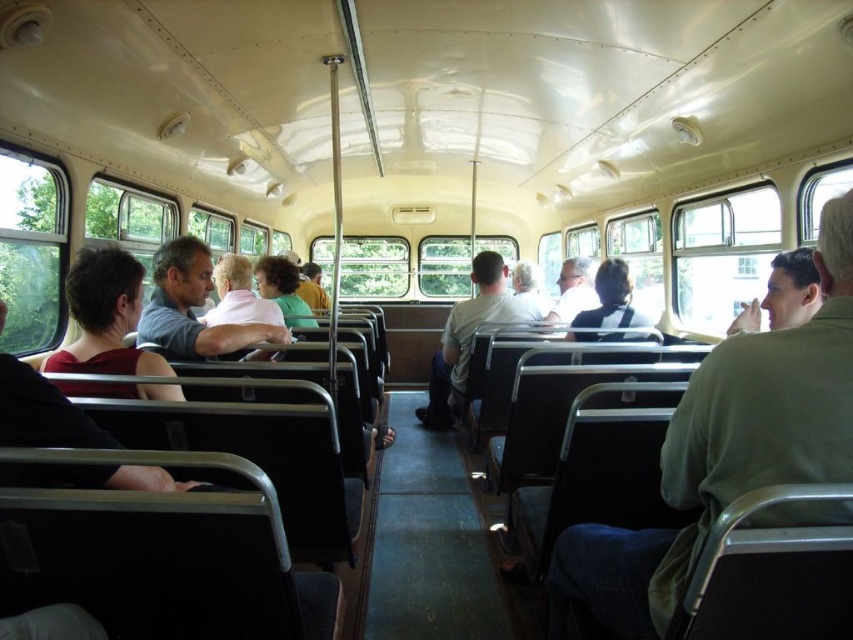
Question: Does light gray fabric shirt at center have a lesser width compared to curly-haired person at center?

Choices:
 (A) no
 (B) yes

Answer: (A)

Question: Is matte gray shirt at center in front of light gray fabric shirt at center?

Choices:
 (A) yes
 (B) no

Answer: (A)

Question: Which of the following is the closest to the observer?

Choices:
 (A) (636, 326)
 (B) (120, 340)
 (C) (161, 257)

Answer: (B)

Question: Is green matte shirt at right above matte red shirt at left?

Choices:
 (A) no
 (B) yes

Answer: (A)

Question: Estimate the real-world distances between objects in this image. Which object is closer to the curly-haired person at center?

Choices:
 (A) green matte shirt at right
 (B) matte red shirt at left
 (C) light gray shirt at center

Answer: (B)

Question: Which object is the farthest from the dark gray fabric jacket at center?

Choices:
 (A) matte red shirt at left
 (B) green matte shirt at right
 (C) light gray shirt at center
 (D) light gray fabric shirt at center

Answer: (A)